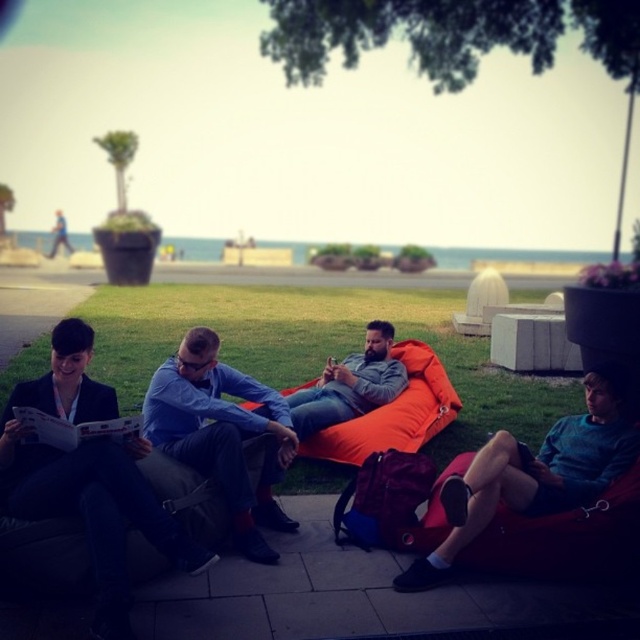
You are trying to choose between two bean bags in the center of the image. The orange fabric bean bag at center and the matte orange bean bag at center. Which one is bigger?

The orange fabric bean bag at center is larger than the matte orange bean bag at center.